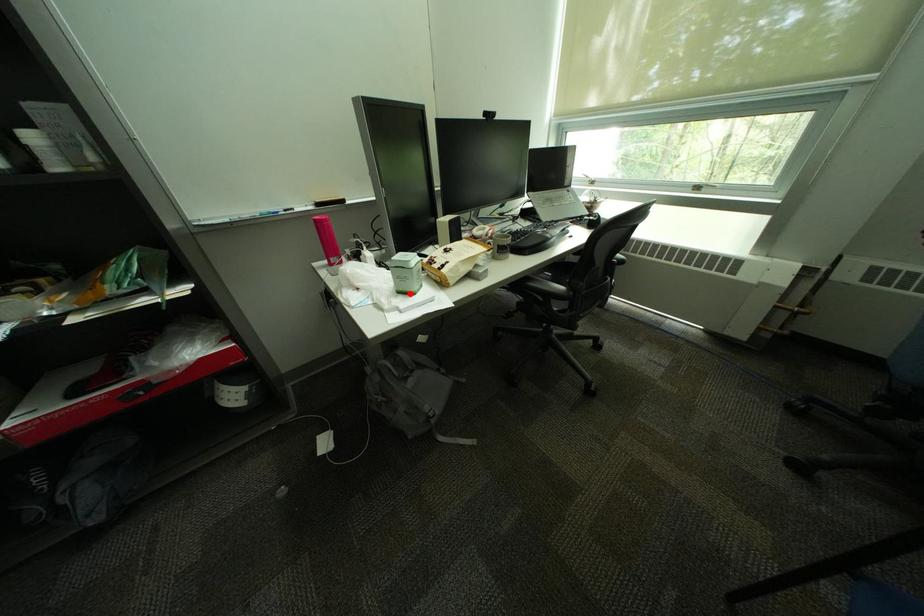
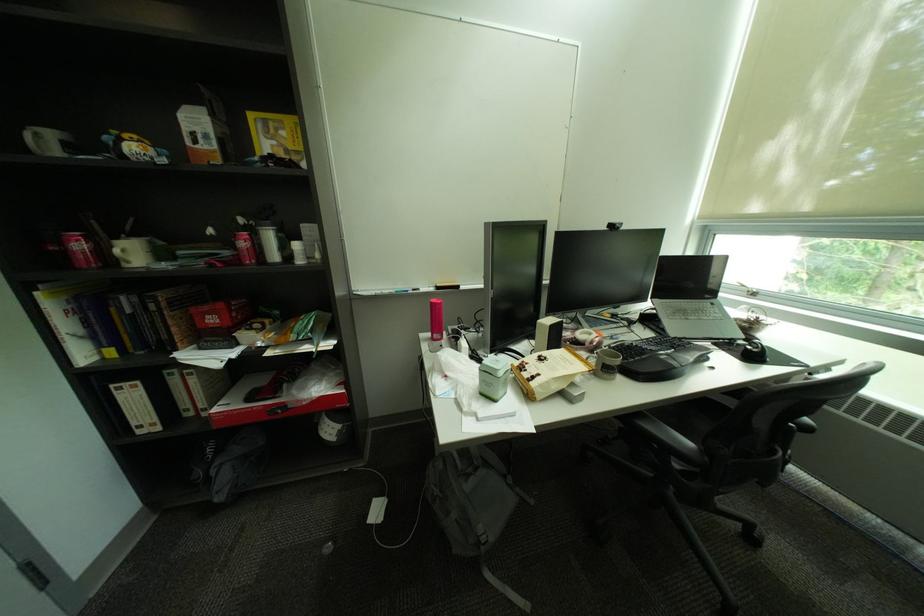
Question: I am providing you with two images of the same scene from different viewpoints. In image1, a red point is highlighted. Considering the same 3D point in image2, which of the following is correct?

Choices:
 (A) It is closer
 (B) It is farther

Answer: (B)